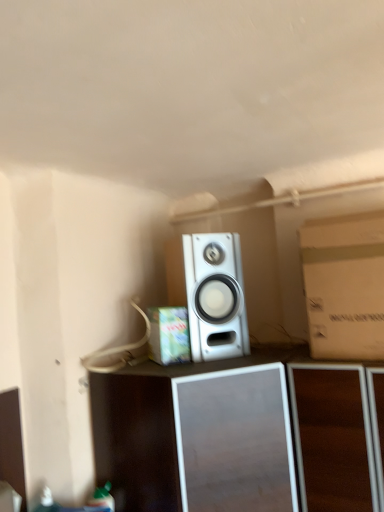
At what (x,y) coordinates should I click in order to perform the action: click on silver metallic speaker at center. Please return your answer as a coordinate pair (x, y). This screenshot has width=384, height=512. Looking at the image, I should click on (235, 436).

Which object is positioned more to the right, silver metallic speaker at center or silver metallic speaker at center?

silver metallic speaker at center is more to the right.

Would you say silver metallic speaker at center is outside silver metallic speaker at center?

Absolutely, silver metallic speaker at center is external to silver metallic speaker at center.

Relative to silver metallic speaker at center, is silver metallic speaker at center in front or behind?

Clearly, silver metallic speaker at center is in front of silver metallic speaker at center.

Is point (219, 482) more distant than point (233, 305)?

No.

Is cardboard box at center, the first cardboard box viewed from the left, aimed at silver metallic speaker at center?

No.

Which is more to the right, cardboard box at center, the first cardboard box viewed from the left, or silver metallic speaker at center?

silver metallic speaker at center is more to the right.

Considering the positions of points (187, 350) and (260, 410), is point (187, 350) closer to camera compared to point (260, 410)?

No.

Looking at the image, does cardboard box at center, placed as the second cardboard box when sorted from right to left, seem bigger or smaller compared to silver metallic speaker at center?

In the image, cardboard box at center, placed as the second cardboard box when sorted from right to left, appears to be smaller than silver metallic speaker at center.

In terms of height, does cardboard box at center, placed as the second cardboard box when sorted from right to left, look taller or shorter compared to silver metallic speaker at center?

In the image, cardboard box at center, placed as the second cardboard box when sorted from right to left, appears to be shorter than silver metallic speaker at center.

Considering the positions of objects cardboard box at center, the first cardboard box viewed from the left, and silver metallic speaker at center in the image provided, who is more to the left, cardboard box at center, the first cardboard box viewed from the left, or silver metallic speaker at center?

cardboard box at center, the first cardboard box viewed from the left, is more to the left.

From the image's perspective, is cardboard box at center, the first cardboard box viewed from the left, below silver metallic speaker at center?

Yes, from the image's perspective, cardboard box at center, the first cardboard box viewed from the left, is below silver metallic speaker at center.

Are cardboard box at center, placed as the second cardboard box when sorted from right to left, and silver metallic speaker at center far apart?

They are positioned close to each other.

Which of these two, silver metallic speaker at center or cardboard box at center, placed as the second cardboard box when sorted from right to left, is bigger?

Bigger between the two is silver metallic speaker at center.

Is silver metallic speaker at center far from cardboard box at center, the first cardboard box viewed from the left?

No, silver metallic speaker at center is not far from cardboard box at center, the first cardboard box viewed from the left.

Which is more to the right, silver metallic speaker at center or cardboard box at center, placed as the second cardboard box when sorted from right to left?

From the viewer's perspective, silver metallic speaker at center appears more on the right side.

Is silver metallic speaker at center located outside cardboard box at center, the first cardboard box viewed from the left?

silver metallic speaker at center lies outside cardboard box at center, the first cardboard box viewed from the left,'s area.

Considering the sizes of objects silver metallic speaker at center and cardboard box at center, placed as the second cardboard box when sorted from right to left, in the image provided, who is thinner, silver metallic speaker at center or cardboard box at center, placed as the second cardboard box when sorted from right to left,?

Thinner between the two is cardboard box at center, placed as the second cardboard box when sorted from right to left.

Which of these two, silver metallic speaker at center or cardboard box at center, the first cardboard box viewed from the left, stands taller?

silver metallic speaker at center.

Find the location of a particular element. The width and height of the screenshot is (384, 512). cardboard box on the left side of silver metallic speaker at center is located at coordinates (169, 335).

Which of these two, silver metallic speaker at center or cardboard box at center, placed as the second cardboard box when sorted from right to left, is bigger?

With larger size is silver metallic speaker at center.

Find the location of `cardboard box above the silver metallic speaker at center (from the image's perspective)`. cardboard box above the silver metallic speaker at center (from the image's perspective) is located at coordinates (344, 285).

Based on the photo, from a real-world perspective, is silver metallic speaker at center on brown cardboard box at right, the first cardboard box from the right?

Yes.

Can we say silver metallic speaker at center lies outside brown cardboard box at right, the first cardboard box from the right?

Yes, silver metallic speaker at center is not within brown cardboard box at right, the first cardboard box from the right.

Considering the relative positions of cardboard box at center, placed as the second cardboard box when sorted from right to left, and brown cardboard box at right, the first cardboard box from the right, in the image provided, is cardboard box at center, placed as the second cardboard box when sorted from right to left, behind brown cardboard box at right, the first cardboard box from the right,?

Yes, it is.

Which of these two, cardboard box at center, the first cardboard box viewed from the left, or brown cardboard box at right, the first cardboard box from the right, stands taller?

Standing taller between the two is brown cardboard box at right, the first cardboard box from the right.

From the image's perspective, which object appears higher, cardboard box at center, placed as the second cardboard box when sorted from right to left, or brown cardboard box at right, the first cardboard box from the right?

brown cardboard box at right, the first cardboard box from the right.

In terms of width, does cardboard box at center, the first cardboard box viewed from the left, look wider or thinner when compared to brown cardboard box at right, the first cardboard box from the right?

Clearly, cardboard box at center, the first cardboard box viewed from the left, has less width compared to brown cardboard box at right, the first cardboard box from the right.

The image size is (384, 512). I want to click on furniture lying in front of the silver metallic speaker at center, so [235, 436].

Where is `furniture to the right of cardboard box at center, the first cardboard box viewed from the left`? The width and height of the screenshot is (384, 512). furniture to the right of cardboard box at center, the first cardboard box viewed from the left is located at coordinates pos(235,436).

When comparing their distances from silver metallic speaker at center, does cardboard box at center, placed as the second cardboard box when sorted from right to left, or silver metallic speaker at center seem further?

Among the two, cardboard box at center, placed as the second cardboard box when sorted from right to left, is located further to silver metallic speaker at center.

Based on their spatial positions, is brown cardboard box at right, the first cardboard box from the right, or silver metallic speaker at center further from silver metallic speaker at center?

brown cardboard box at right, the first cardboard box from the right, lies further to silver metallic speaker at center than the other object.

Estimate the real-world distances between objects in this image. Which object is further from cardboard box at center, the first cardboard box viewed from the left, silver metallic speaker at center or brown cardboard box at right, arranged as the 2th cardboard box when viewed from the left?

brown cardboard box at right, arranged as the 2th cardboard box when viewed from the left.

Based on their spatial positions, is cardboard box at center, placed as the second cardboard box when sorted from right to left, or brown cardboard box at right, the first cardboard box from the right, closer to silver metallic speaker at center?

cardboard box at center, placed as the second cardboard box when sorted from right to left, is positioned closer to the anchor silver metallic speaker at center.

When comparing their distances from cardboard box at center, the first cardboard box viewed from the left, does silver metallic speaker at center or silver metallic speaker at center seem closer?

silver metallic speaker at center.

Consider the image. Estimate the real-world distances between objects in this image. Which object is further from brown cardboard box at right, the first cardboard box from the right, silver metallic speaker at center or cardboard box at center, placed as the second cardboard box when sorted from right to left?

cardboard box at center, placed as the second cardboard box when sorted from right to left, is further to brown cardboard box at right, the first cardboard box from the right.

When comparing their distances from brown cardboard box at right, arranged as the 2th cardboard box when viewed from the left, does silver metallic speaker at center or silver metallic speaker at center seem further?

silver metallic speaker at center is positioned further to the anchor brown cardboard box at right, arranged as the 2th cardboard box when viewed from the left.

When comparing their distances from brown cardboard box at right, arranged as the 2th cardboard box when viewed from the left, does cardboard box at center, the first cardboard box viewed from the left, or silver metallic speaker at center seem closer?

Based on the image, silver metallic speaker at center appears to be nearer to brown cardboard box at right, arranged as the 2th cardboard box when viewed from the left.

Identify the location of cardboard box between silver metallic speaker at center and silver metallic speaker at center in the vertical direction. (169, 335).

This screenshot has height=512, width=384. In order to click on furniture between cardboard box at center, placed as the second cardboard box when sorted from right to left, and brown cardboard box at right, arranged as the 2th cardboard box when viewed from the left, from left to right in this screenshot , I will do `click(235, 436)`.

Locate an element on the screen. This screenshot has height=512, width=384. home appliance between cardboard box at center, the first cardboard box viewed from the left, and brown cardboard box at right, arranged as the 2th cardboard box when viewed from the left, from left to right is located at coordinates (212, 295).

Identify the location of home appliance that lies between brown cardboard box at right, arranged as the 2th cardboard box when viewed from the left, and silver metallic speaker at center from top to bottom. (212, 295).